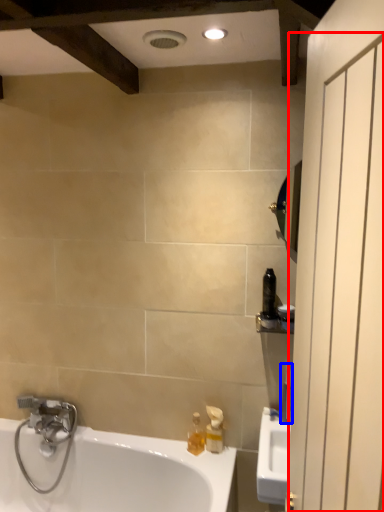
Question: Which of the following is the closest to the observer, screen door (highlighted by a red box) or toiletry (highlighted by a blue box)?

Choices:
 (A) screen door
 (B) toiletry

Answer: (A)